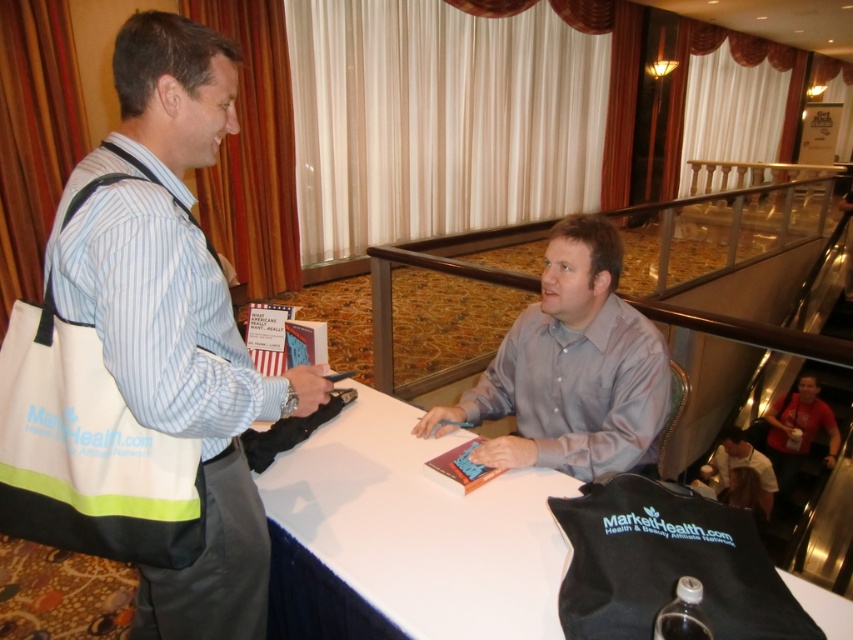
Question: Which point is farther to the camera?

Choices:
 (A) (360, 428)
 (B) (549, 243)
 (C) (140, 152)

Answer: (A)

Question: Is light gray satin shirt at center closer to the viewer compared to light brown leather jacket at lower right?

Choices:
 (A) yes
 (B) no

Answer: (A)

Question: Observing the image, what is the correct spatial positioning of white canvas tote bag at left in reference to light brown leather jacket at lower right?

Choices:
 (A) right
 (B) left

Answer: (B)

Question: Which point is closer to the camera?

Choices:
 (A) (718, 465)
 (B) (160, 141)
 (C) (593, 333)

Answer: (B)

Question: Is white canvas tote bag at left wider than white smooth table at center?

Choices:
 (A) no
 (B) yes

Answer: (A)

Question: Among these objects, which one is nearest to the camera?

Choices:
 (A) light brown leather jacket at lower right
 (B) white smooth table at center

Answer: (B)